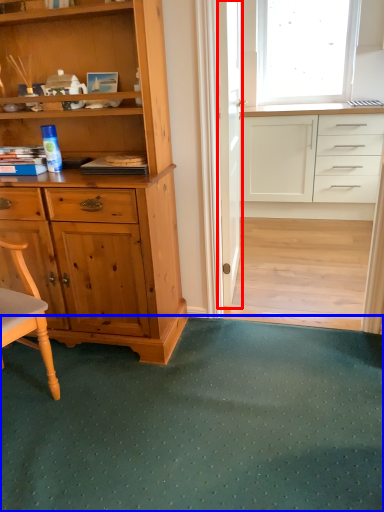
Question: Which object appears farthest to the camera in this image, screen door (highlighted by a red box) or doormat (highlighted by a blue box)?

Choices:
 (A) screen door
 (B) doormat

Answer: (A)